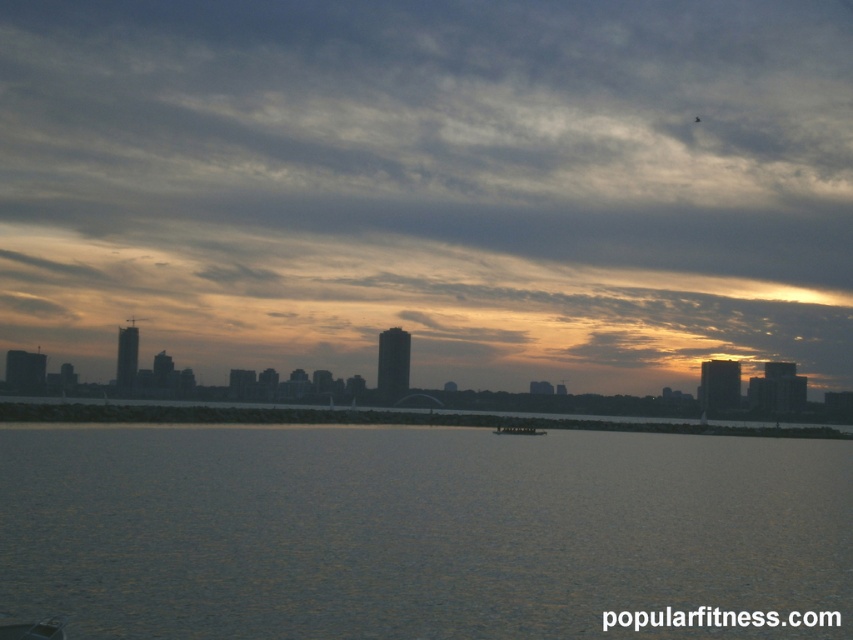
You are an artist trying to paint the waterfront scene. You notice the cloudy sky at center and the silvery reflective water at center. Which object should you make bigger in your painting to accurately represent their sizes in the image?

The cloudy sky at center should be made bigger in the painting since it has a larger size compared to the silvery reflective water at center according to the description.

From the picture: You are standing on the dock and want to throw a stone into the silvery reflective water at center. If you can throw a stone 100 feet, will it reach the water?

The silvery reflective water at center is 93.87 feet away from you, so yes, the stone will reach the water since the distance is within your throwing range.